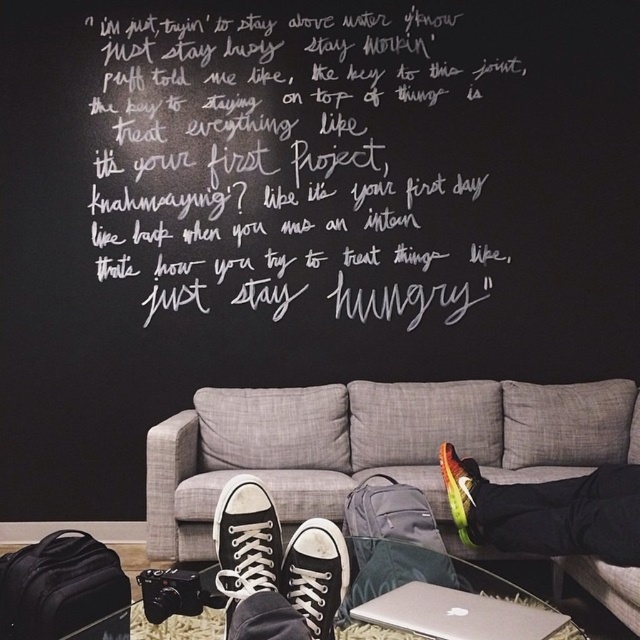
What are the coordinates of the white chalk writing at upper center?

The coordinates of the white chalk writing at upper center are at point (308, 168).